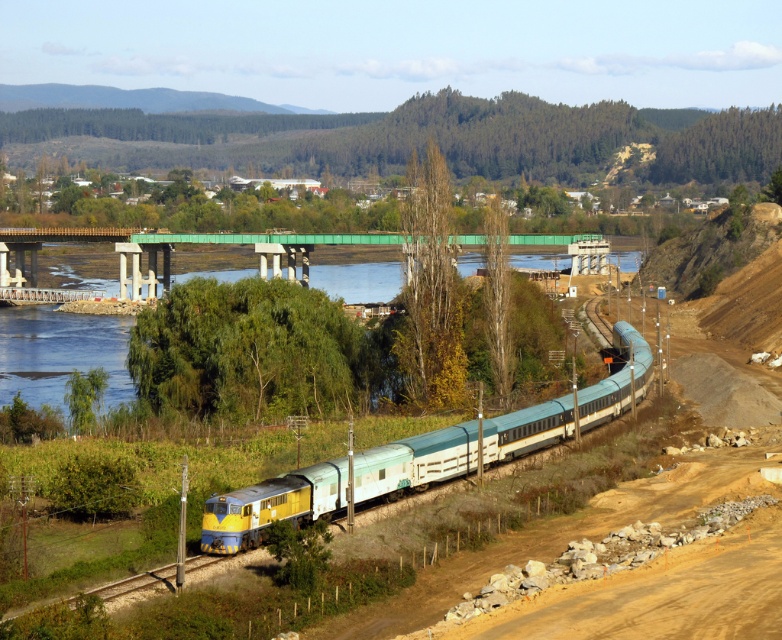
You are a train engineer who needs to ensure that the green concrete bridge at center can safely support the weight of the yellow metallic train track at lower left. Based on the scene description, can you confirm if the bridge is tall enough to accommodate the train track?

The green concrete bridge at center is taller than the yellow metallic train track at lower left, so it is tall enough to accommodate the train track.

You are a photographer standing at the position of the camera capturing this railway scene. You want to focus on both the point at point (612,326) and the point at point (120,582). Which point should you adjust your focus to first if you want to capture both in a single shot without moving the camera?

You should focus on point (612,326) first because it is closer to the camera than point (120,582), allowing you to capture both points in focus using a smaller aperture or adjusting the focal plane accordingly.